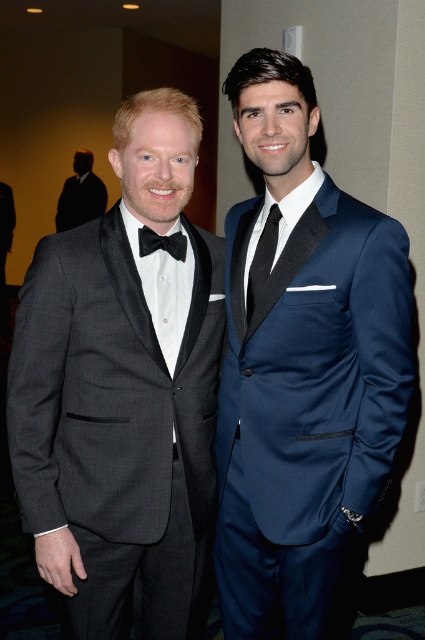
Question: Based on their relative distances, which object is nearer to the navy satin suit at center?

Choices:
 (A) dark suit at left
 (B) matte black tuxedo at left
 (C) black satin bow tie at center

Answer: (B)

Question: Can you confirm if dark suit at left is thinner than black satin tie at center?

Choices:
 (A) yes
 (B) no

Answer: (B)

Question: Is matte black tuxedo at left above dark suit at left?

Choices:
 (A) yes
 (B) no

Answer: (B)

Question: Considering the real-world distances, which object is closest to the black satin bow tie at center?

Choices:
 (A) black satin tie at center
 (B) matte black tuxedo at left
 (C) navy satin suit at center

Answer: (A)

Question: Which of the following is the closest to the observer?

Choices:
 (A) navy satin suit at center
 (B) black satin tie at center

Answer: (A)

Question: Is matte black tuxedo at left smaller than navy satin suit at center?

Choices:
 (A) no
 (B) yes

Answer: (A)